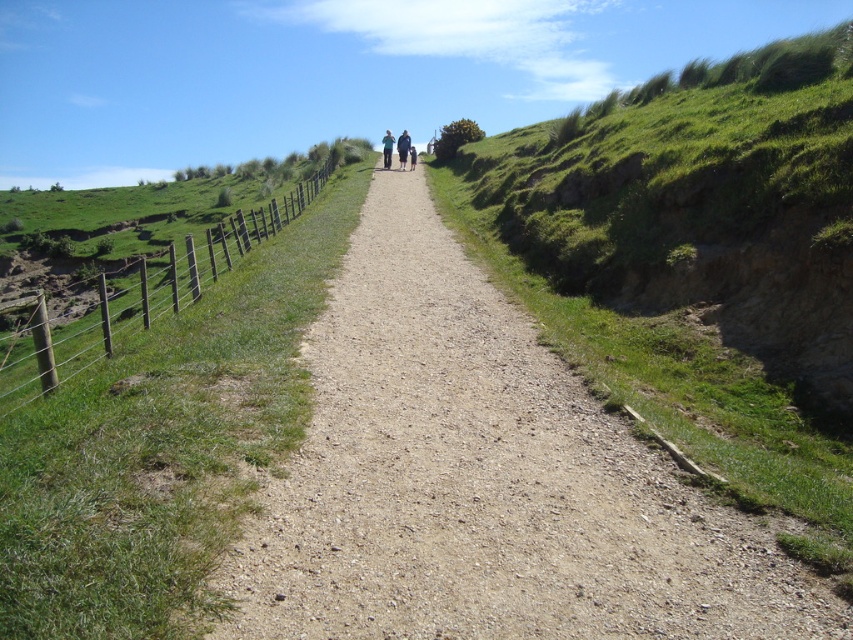
You are a hiker standing at the starting point of the gravel path. You want to take a photo of the green wooden fence at left from the path. Which direction should you face to capture it in your camera view?

The green wooden fence at left is positioned at point (x=140, y=296), so you should face to the left side of the path to capture it in your camera view.

You are a hiker trying to cross a gravel path that is 18 meters long. You see the green wooden fence at left and dark blue jeans at center. Can you walk straight across the path without stepping on either object?

The distance between the green wooden fence at left and dark blue jeans at center is 18.03 meters, so yes, you can walk straight across the path without stepping on either object since the path is 18 meters long and the objects are positioned at opposite ends.